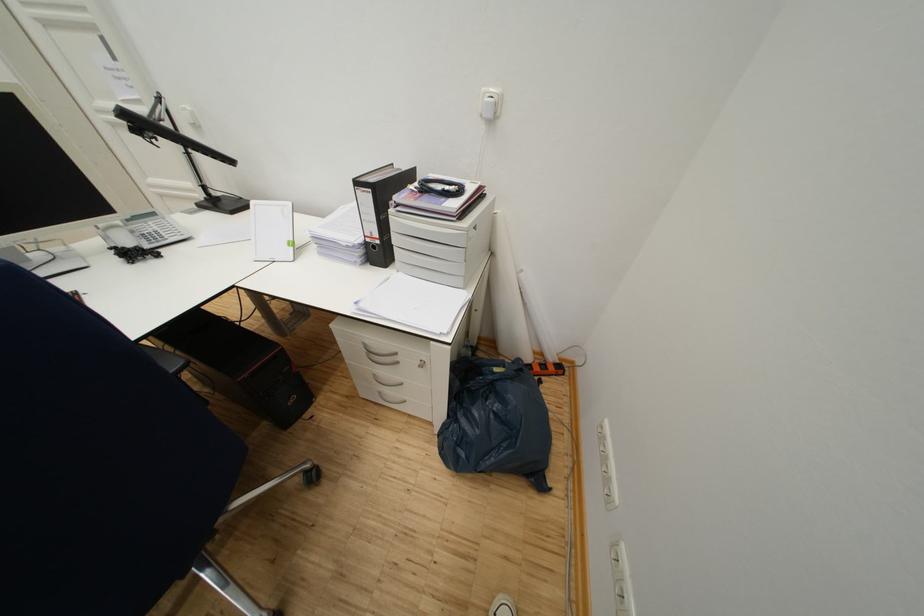
Where would you press the orange power switch? Please return your answer as a coordinate pair (x, y).

(545, 368)